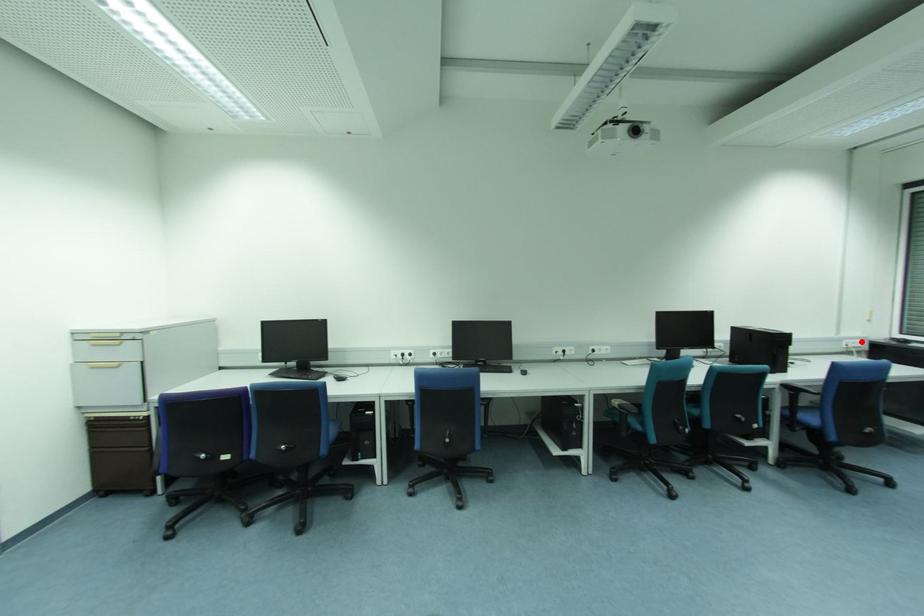
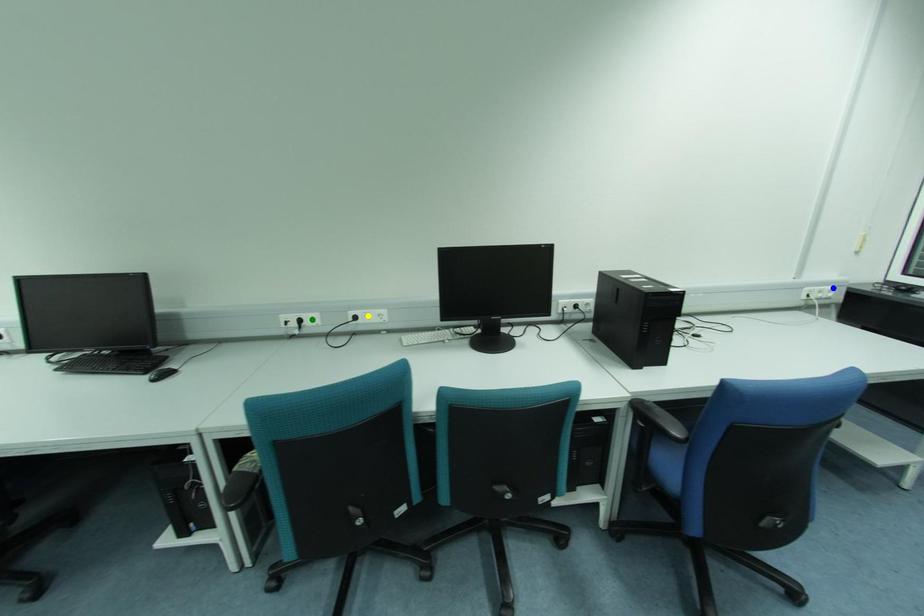
Question: I am providing you with two images of the same scene from different viewpoints. A red point is marked on the first image. You are given multiple points on the second image. Which point in image 2 represents the same 3d spot as the red point in image 1?

Choices:
 (A) green point
 (B) blue point
 (C) yellow point

Answer: (B)